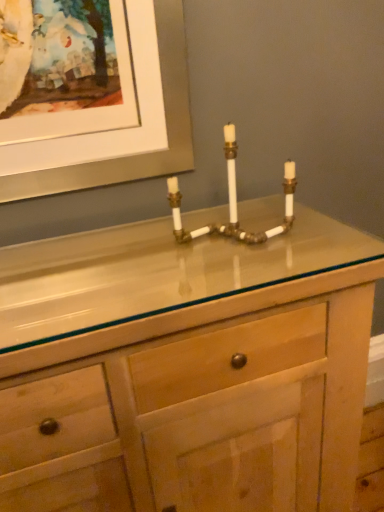
Locate an element on the screen. The height and width of the screenshot is (512, 384). free space behind brass/bronze pipe at center is located at coordinates (226, 215).